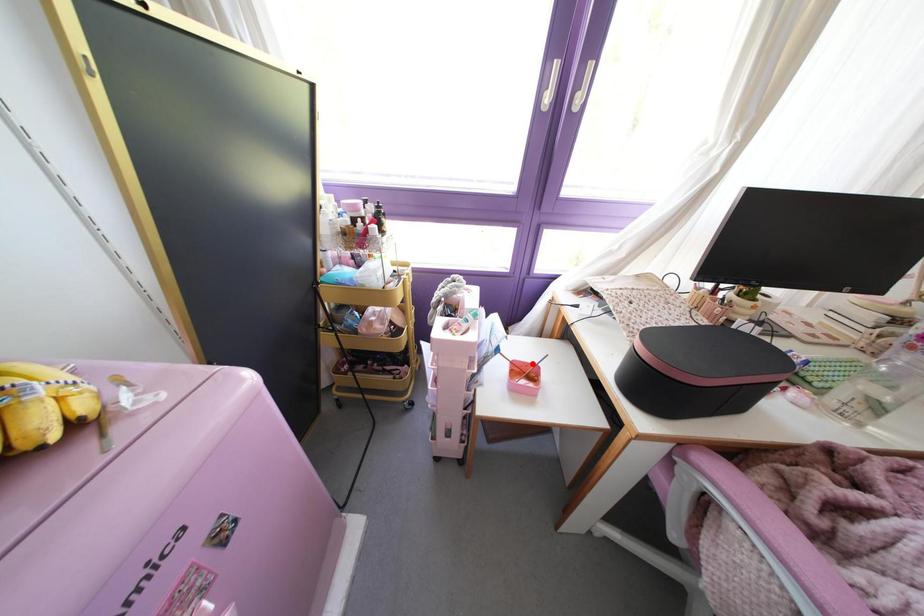
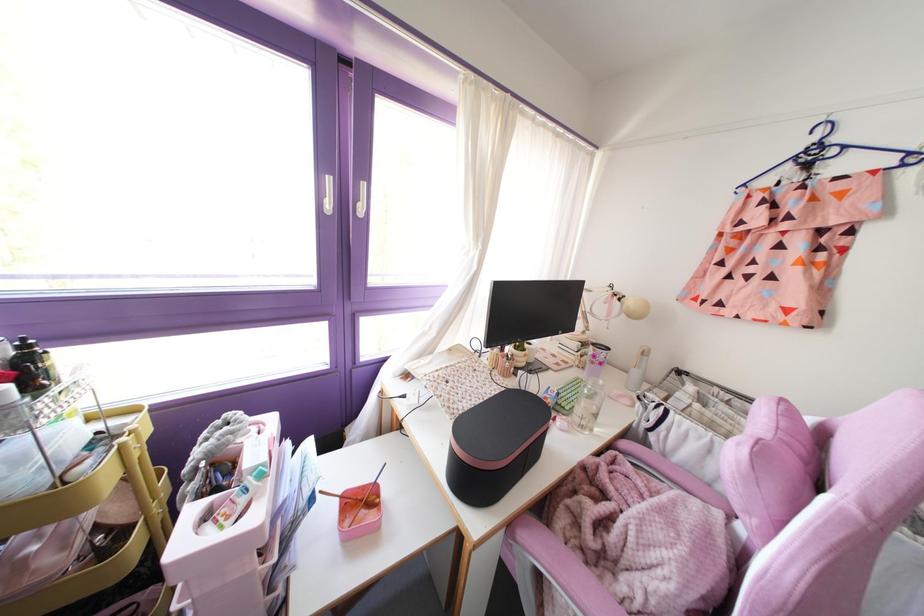
Question: I am providing you with two images of the same scene from different viewpoints. Image1 has a red point marked. In image2, the corresponding 3D location appears at what relative position? Reply with the corresponding letter.

Choices:
 (A) Closer
 (B) Farther

Answer: (A)